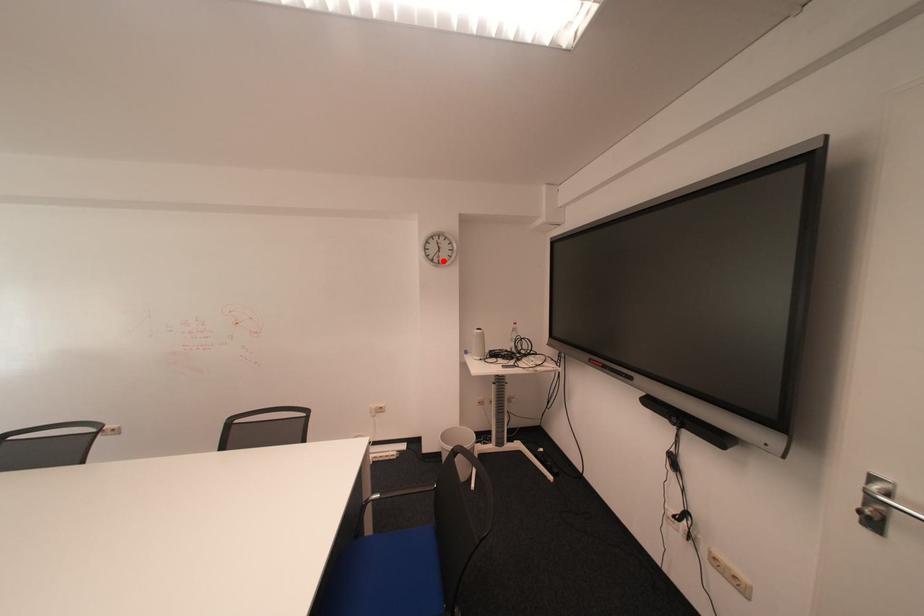
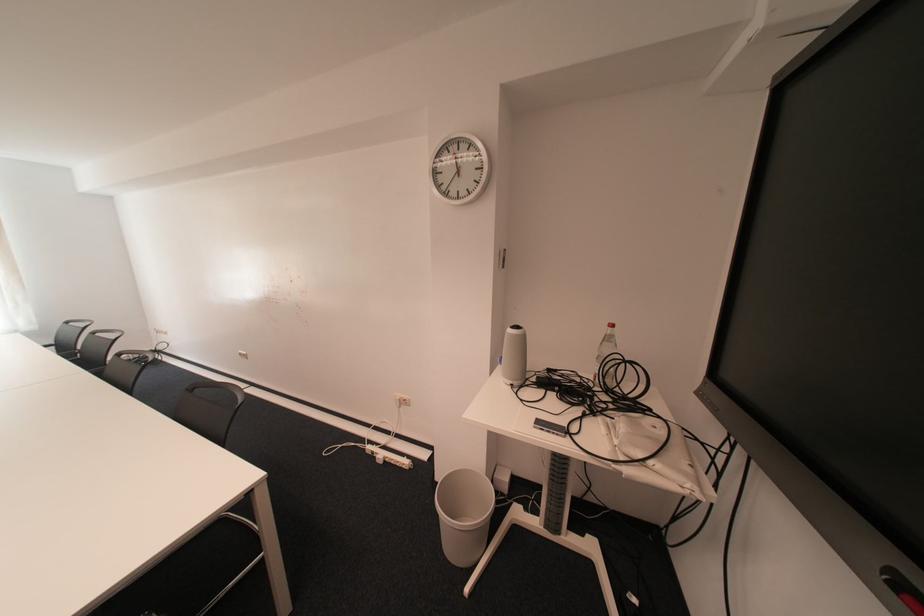
Find the pixel in the second image that matches the highlighted location in the first image.

(457, 195)